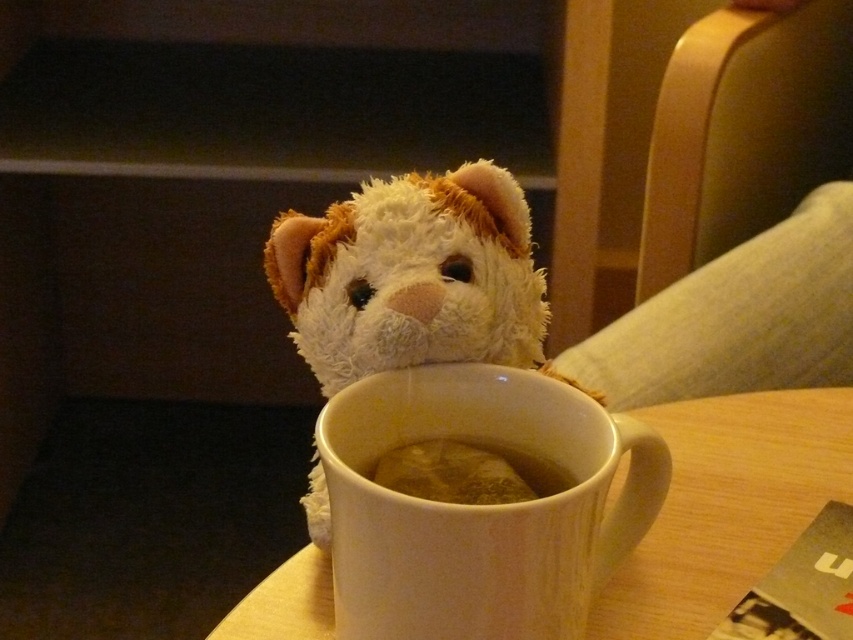
Does white matte mug at center appear under brown matte coffee at center?

Yes.

Locate an element on the screen. white matte mug at center is located at coordinates (480, 506).

This screenshot has height=640, width=853. What are the coordinates of `white matte mug at center` in the screenshot? It's located at (480, 506).